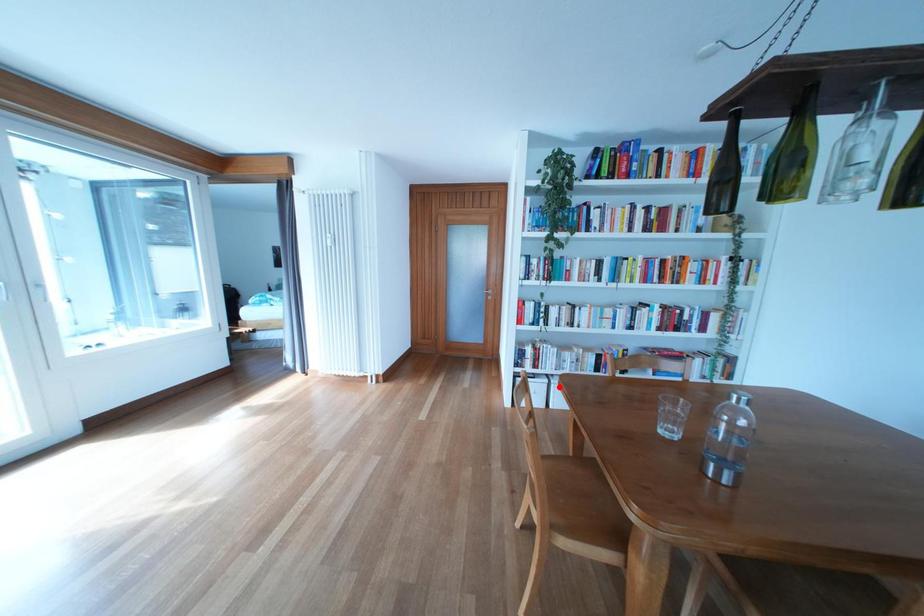
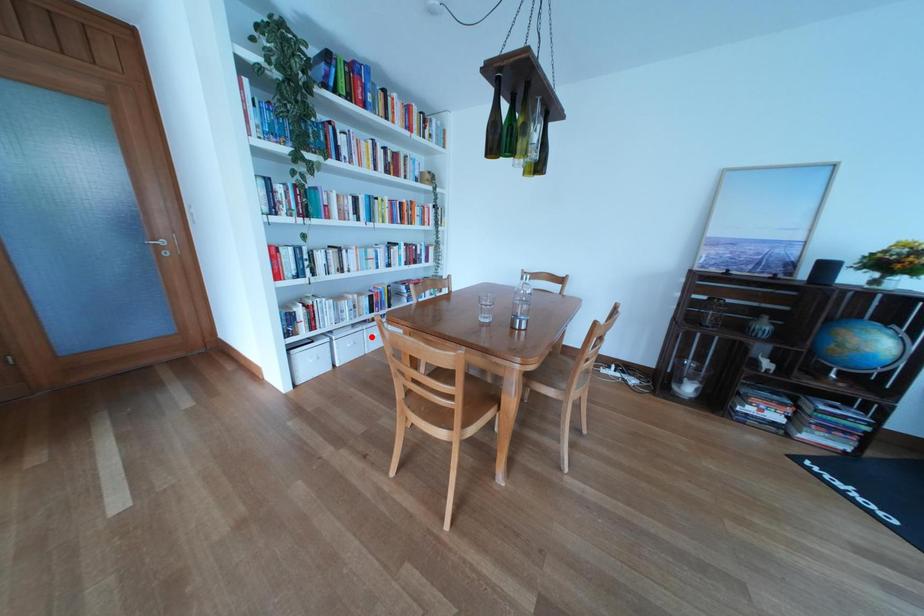
I am providing you with two images of the same scene from different viewpoints. A red point is marked on the first image and another point is marked on the second image. Is the red point in image1 aligned with the point shown in image2?

No